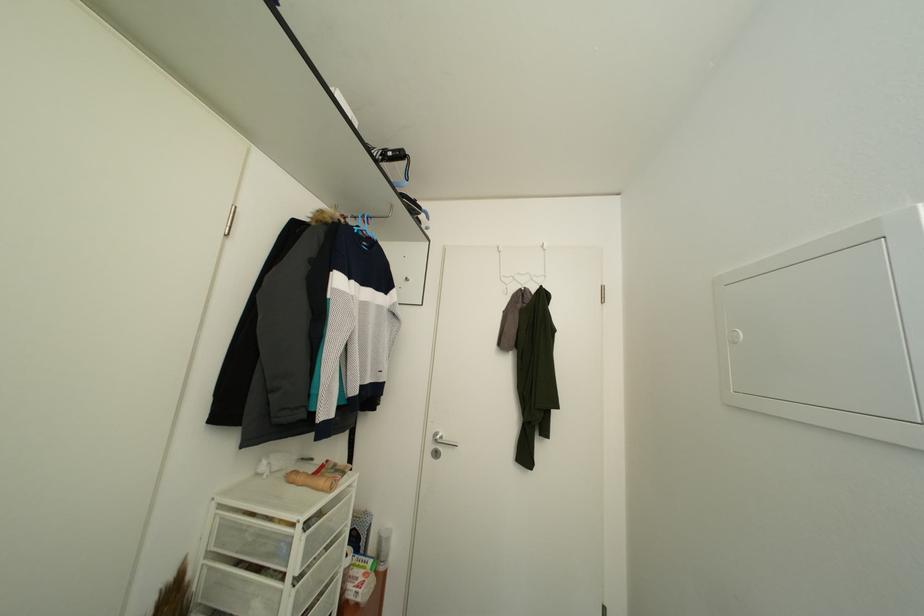
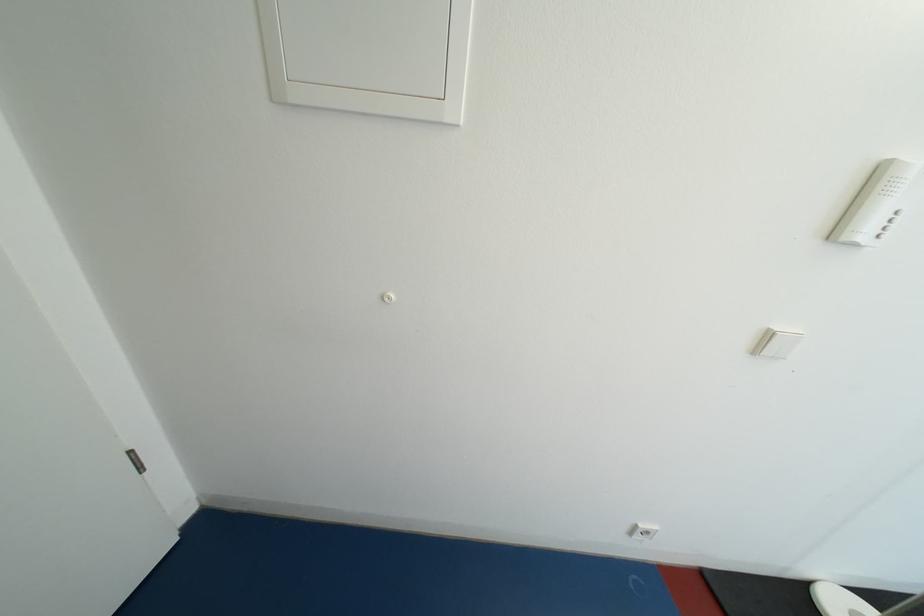
How did the camera likely rotate?

The rotation direction of the camera is right-down.